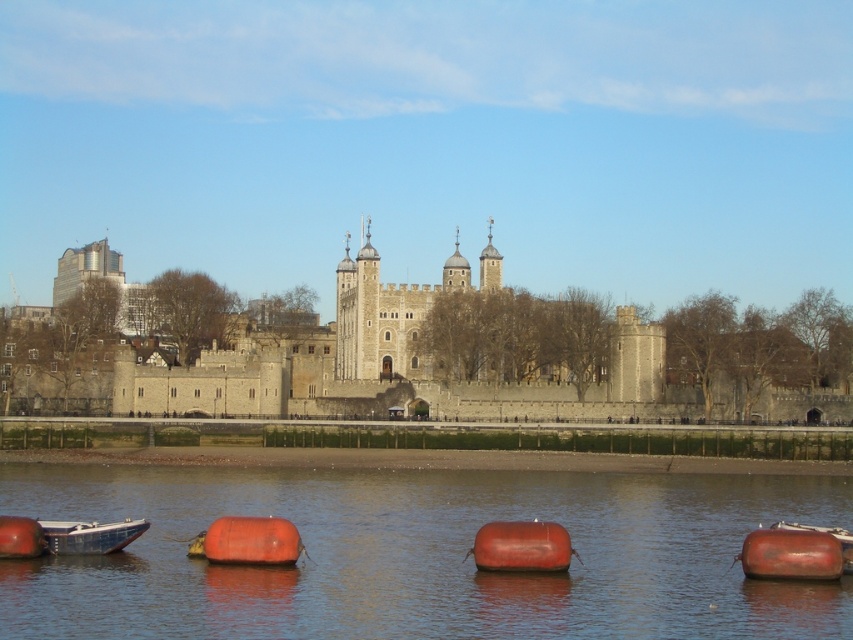
Question: Which of the following is the closest to the observer?

Choices:
 (A) stone castle at center
 (B) rubber orange buoy at lower center

Answer: (B)

Question: Does smooth rubber buoys at lower center come in front of metallic blue boat at lower left?

Choices:
 (A) no
 (B) yes

Answer: (B)

Question: Does rubber matte buoy at lower center appear over metallic blue boat at lower left?

Choices:
 (A) yes
 (B) no

Answer: (A)

Question: Can you confirm if smooth rubber buoys at lower center is positioned to the left of matte orange buoy at lower left?

Choices:
 (A) yes
 (B) no

Answer: (B)

Question: Which point is farther to the camera?

Choices:
 (A) (550, 531)
 (B) (91, 531)
 (C) (21, 529)

Answer: (B)

Question: Which point is farther from the camera taking this photo?

Choices:
 (A) click(756, 573)
 (B) click(218, 545)
 (C) click(97, 545)
 (D) click(514, 557)

Answer: (C)